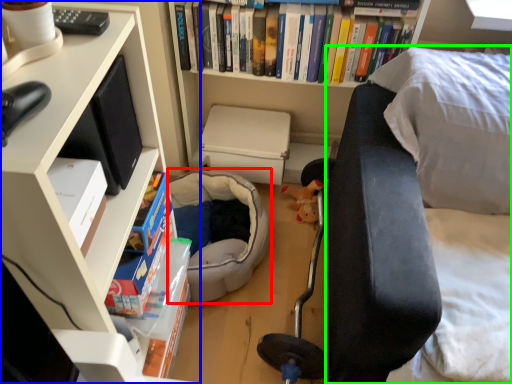
Question: Based on their relative distances, which object is nearer to bean bag chair (highlighted by a red box)? Choose from bookcase (highlighted by a blue box) and couch (highlighted by a green box).

Choices:
 (A) bookcase
 (B) couch

Answer: (B)